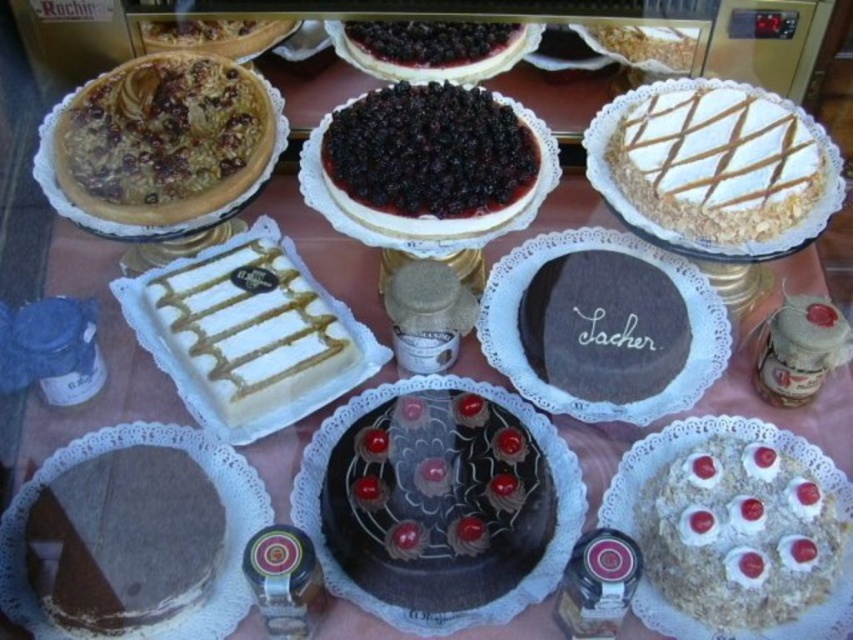
Question: Which point is farther to the camera?

Choices:
 (A) (201, 172)
 (B) (637, 29)
 (C) (619, 356)

Answer: (B)

Question: Is blackberry-filled cheesecake at center above white glossy cake at center?

Choices:
 (A) yes
 (B) no

Answer: (A)

Question: Can you confirm if white crumbly cake at upper right is positioned above blackberry-filled cheesecake at center?

Choices:
 (A) no
 (B) yes

Answer: (B)

Question: Which point is closer to the camera?

Choices:
 (A) (677, 68)
 (B) (235, 396)
 (C) (534, 132)
 (D) (430, 595)

Answer: (D)

Question: Can you confirm if chocolate glazed cake at center is thinner than dark chocolate cake at center?

Choices:
 (A) no
 (B) yes

Answer: (A)

Question: Which object is positioned farthest from the blackberry-filled cheesecake at center?

Choices:
 (A) matte brown pie at upper left
 (B) white textured cake at upper right
 (C) white crumbly cake at upper right

Answer: (B)